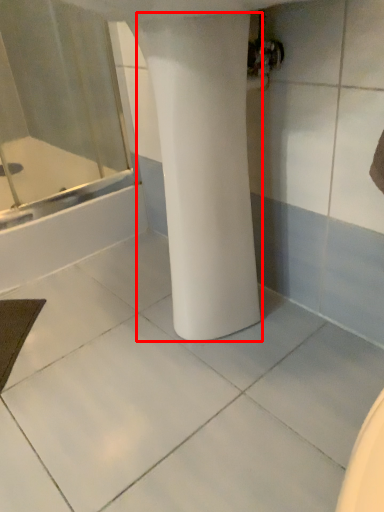
Question: From the image's perspective, what is the correct spatial positioning of pillar (annotated by the red box) in reference to bathtub?

Choices:
 (A) below
 (B) above

Answer: (A)